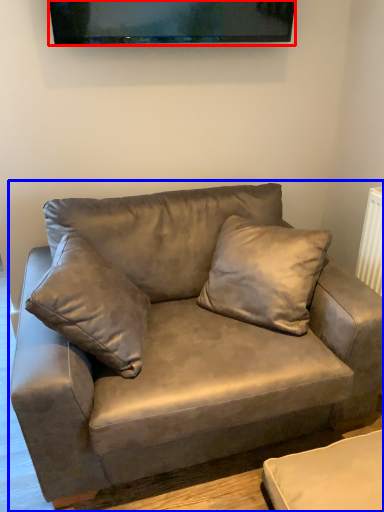
Question: Which of the following is the closest to the observer, television (highlighted by a red box) or studio couch (highlighted by a blue box)?

Choices:
 (A) television
 (B) studio couch

Answer: (B)